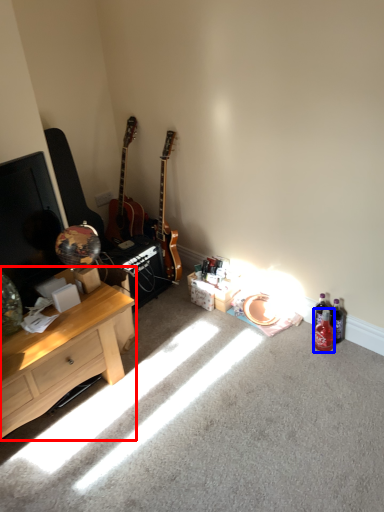
Question: Which object is closer to the camera taking this photo, desk (highlighted by a red box) or bottle (highlighted by a blue box)?

Choices:
 (A) desk
 (B) bottle

Answer: (A)